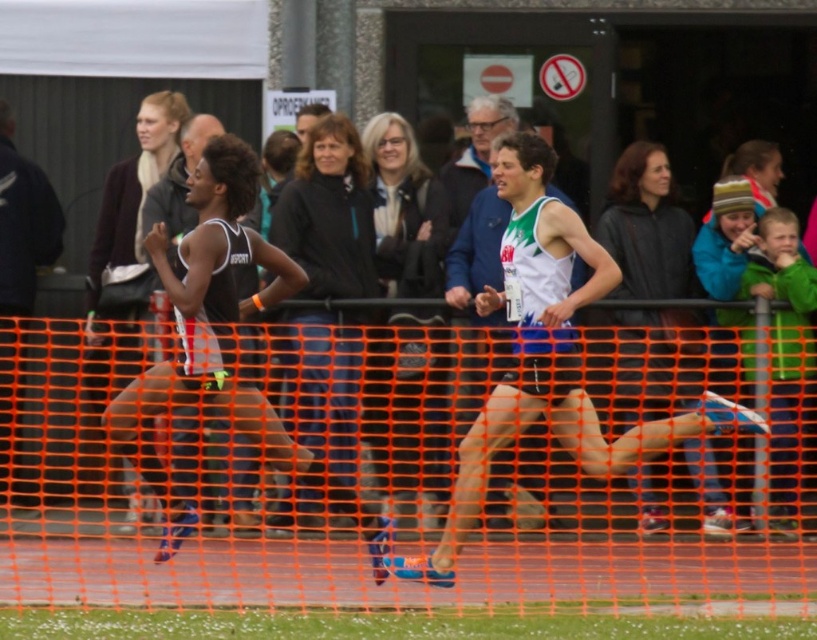
Does point (557, 436) come in front of point (501, 104)?

Yes.

Is white fabric tank top at center taller than white jersey at center?

Yes.

Locate an element on the screen. white fabric tank top at center is located at coordinates (547, 355).

How distant is matte black tank top at left from white jersey at center?

6.58 feet

Can you confirm if matte black tank top at left is wider than white jersey at center?

Indeed, matte black tank top at left has a greater width compared to white jersey at center.

Locate an element on the screen. The image size is (817, 640). matte black tank top at left is located at coordinates (213, 305).

Is point (115, 324) closer to camera compared to point (471, 209)?

Yes, it is.

Which is in front, point (117, 513) or point (481, 97)?

Point (117, 513)

This screenshot has width=817, height=640. Find the location of `orange mesh fence at center`. orange mesh fence at center is located at coordinates (389, 472).